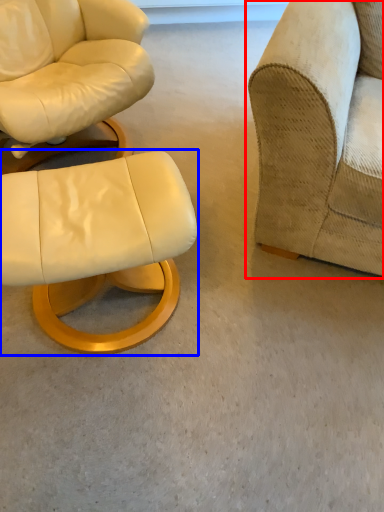
Question: Which object appears closest to the camera in this image, studio couch (highlighted by a red box) or chair (highlighted by a blue box)?

Choices:
 (A) studio couch
 (B) chair

Answer: (A)